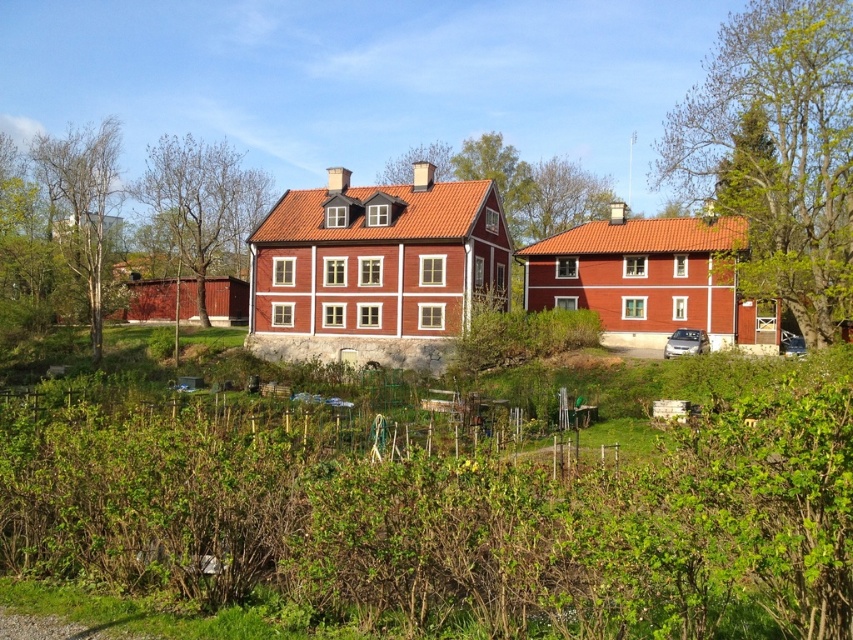
Question: Can you confirm if green leafy tree at upper right is bigger than green leafy tree at left?

Choices:
 (A) no
 (B) yes

Answer: (B)

Question: Among these objects, which one is farthest from the camera?

Choices:
 (A) green leafy tree at center
 (B) green leafy tree at left
 (C) green leafy tree at upper center
 (D) bare wood tree at left

Answer: (C)

Question: Is green leafy tree at left thinner than green leafy tree at center?

Choices:
 (A) no
 (B) yes

Answer: (A)

Question: Does green leafy tree at left appear under green leafy tree at upper center?

Choices:
 (A) no
 (B) yes

Answer: (B)

Question: Among these objects, which one is farthest from the camera?

Choices:
 (A) green leafy tree at left
 (B) green leafy tree at upper right
 (C) green leafy tree at upper center
 (D) green leafy tree at center

Answer: (C)

Question: Which point is closer to the camera?

Choices:
 (A) (152, 182)
 (B) (584, 198)

Answer: (A)